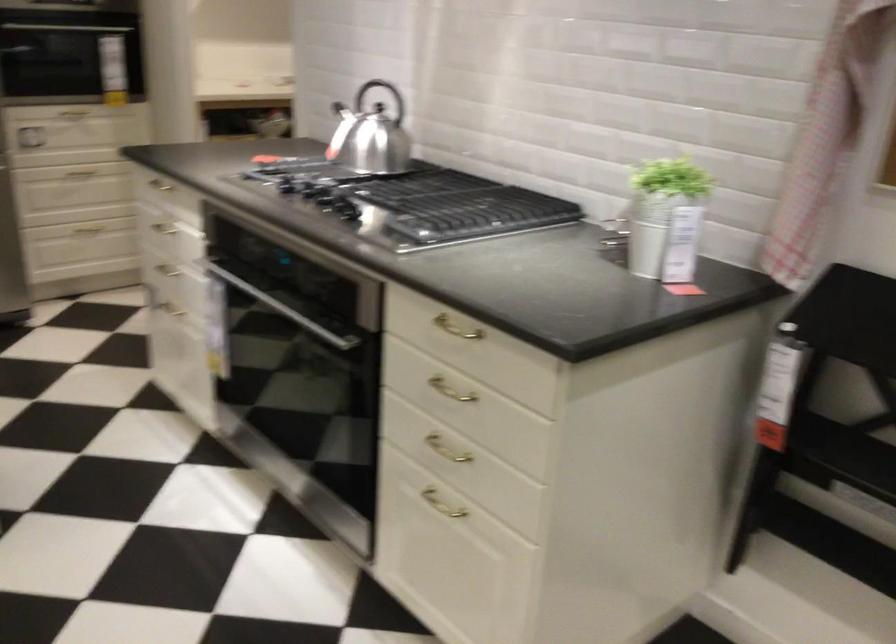
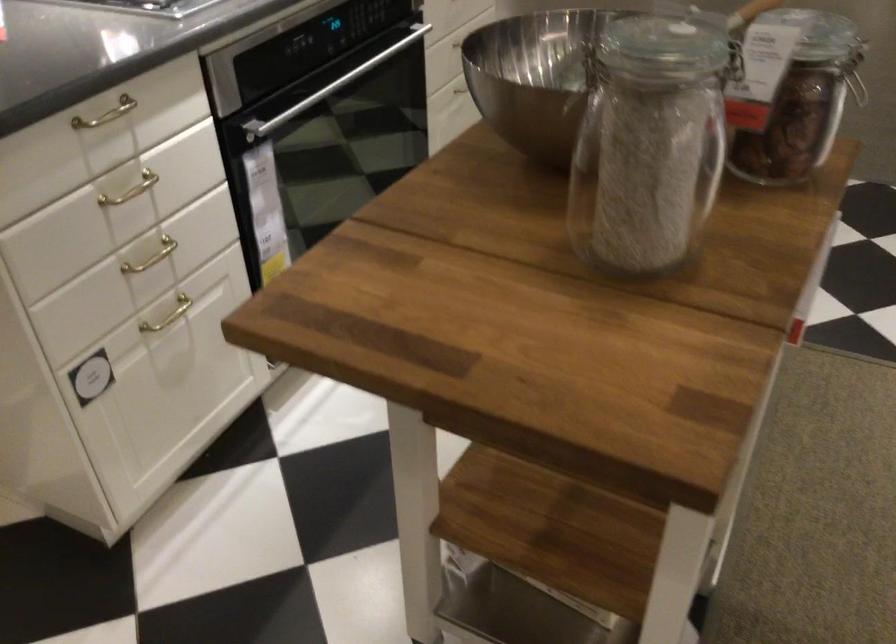
In the second image, find the point that corresponds to [168,298] in the first image.

(168, 315)